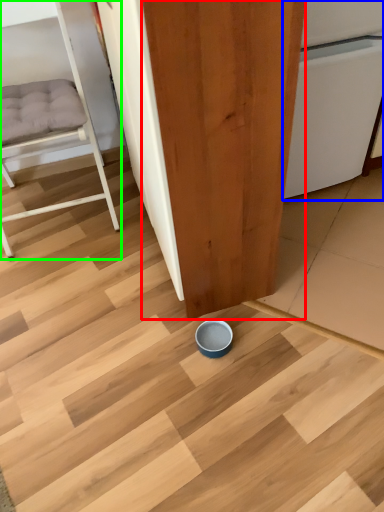
Question: Which is farther away from plywood (highlighted by a red box)? dish washer (highlighted by a blue box) or furniture (highlighted by a green box)?

Choices:
 (A) dish washer
 (B) furniture

Answer: (B)